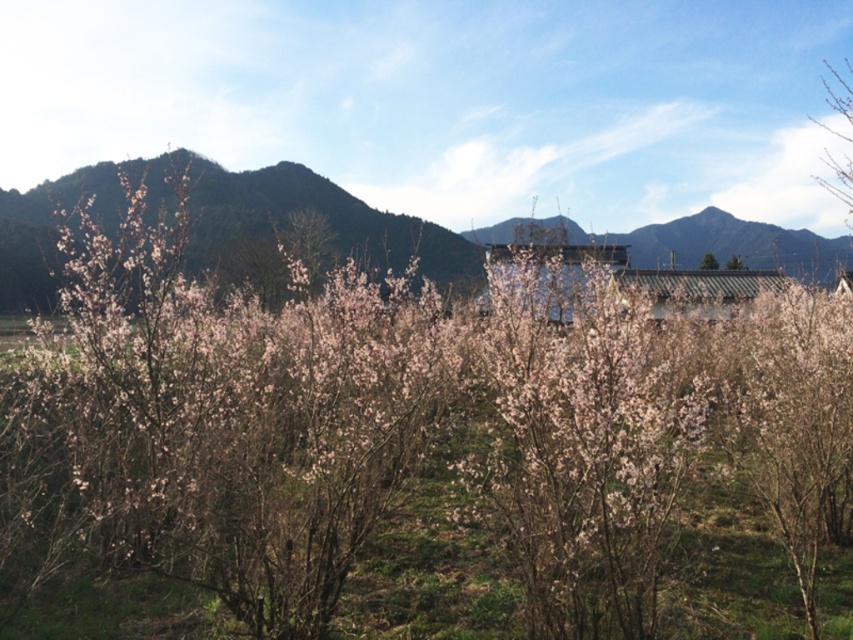
You are an artist planning to paint this rural landscape. You want to emphasize the green matte mountain at upper left and the pink matte tree at center. Which object should you paint larger to maintain the scene proportions?

The green matte mountain at upper left should be painted larger than the pink matte tree at center because it has a larger size compared to the pink matte tree at center according to the description.

You are standing at the point closest to the viewer in the image. Which of the two points, point (163, 164) or point (297, 280), is farther away from you?

Point (163, 164) is behind point (297, 280), so it is farther away from you.